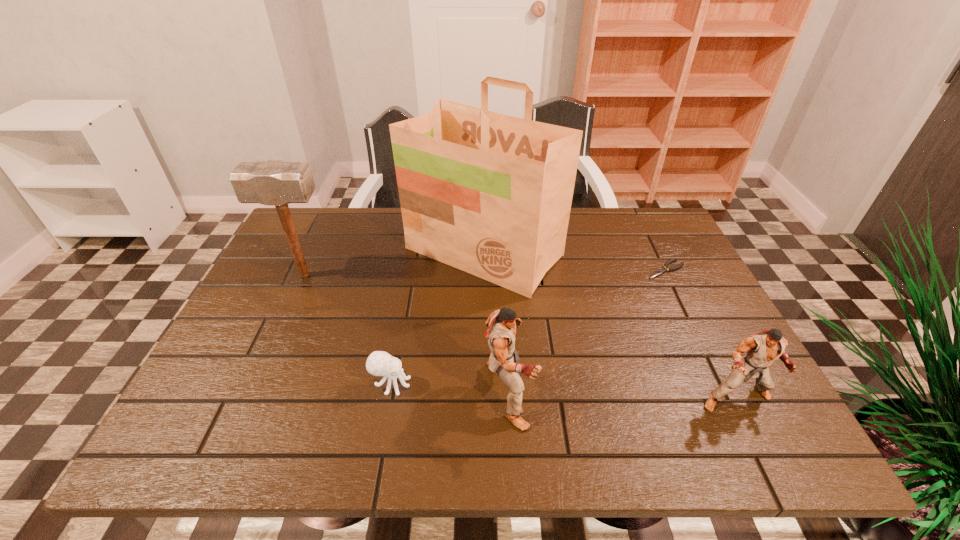
Please point a free position for a puncher on the left. Please provide its 2D coordinates. Your answer should be formatted as a tuple, i.e. [(x, y)], where the tuple contains the x and y coordinates of a point satisfying the conditions above.

[(284, 388)]